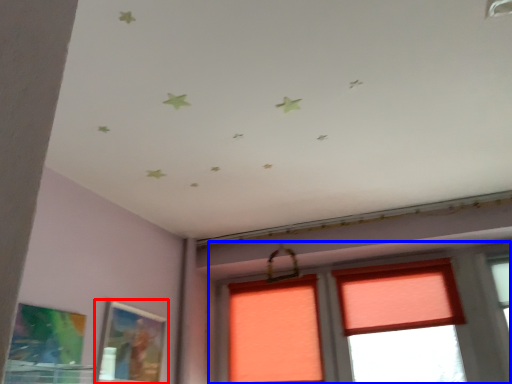
Question: Which of the following is the farthest to the observer, picture frame (highlighted by a red box) or window (highlighted by a blue box)?

Choices:
 (A) picture frame
 (B) window

Answer: (B)